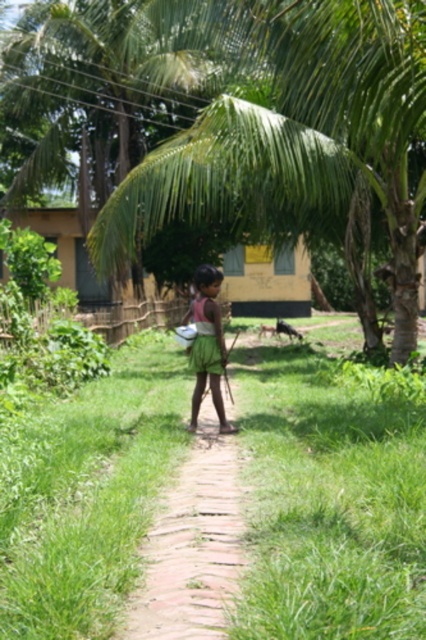
You are a photographer trying to capture the child in the scene. Since you want to focus on the child, you need to adjust your camera to ensure the green leafy coconut tree at center and the green fabric skirt at center are in focus. Which object should you focus on first to ensure both are in focus?

The green leafy coconut tree at center is closer to the viewer than the green fabric skirt at center. To ensure both are in focus, you should focus on the green leafy coconut tree at center first.

You are a photographer trying to capture the child in the scene. Since both the green grass at center and the green fabric skirt at center are present, which one will be more visible in the photo due to their height?

The green fabric skirt at center is taller than the green grass at center, so the green fabric skirt at center will be more visible in the photo.